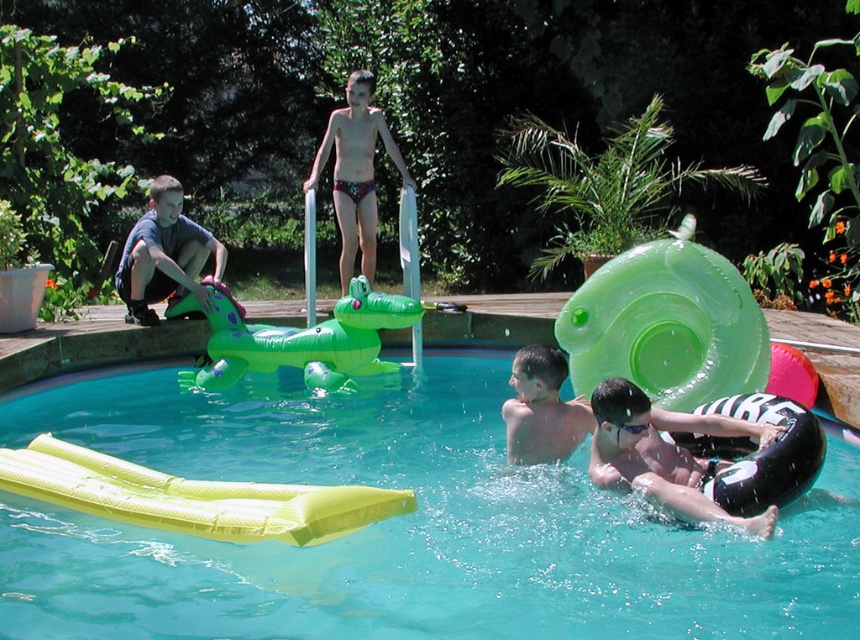
Can you confirm if black rubber ring at lower right is positioned below matte green crocodile at left?

Yes.

Is point (647, 440) farther from camera compared to point (164, 276)?

That is False.

The height and width of the screenshot is (640, 860). I want to click on black rubber ring at lower right, so click(x=664, y=454).

The image size is (860, 640). I want to click on green inflatable crocodile at center, so click(301, 340).

Does green inflatable crocodile at center appear on the right side of matte green crocodile at left?

Correct, you'll find green inflatable crocodile at center to the right of matte green crocodile at left.

What do you see at coordinates (301, 340) in the screenshot? The height and width of the screenshot is (640, 860). I see `green inflatable crocodile at center` at bounding box center [301, 340].

The image size is (860, 640). Identify the location of green inflatable crocodile at center. (301, 340).

Is green inflatable crocodile at center to the right of multicolored bikini at center from the viewer's perspective?

Incorrect, green inflatable crocodile at center is not on the right side of multicolored bikini at center.

Looking at this image, which is more to the right, green inflatable crocodile at center or multicolored bikini at center?

multicolored bikini at center

The width and height of the screenshot is (860, 640). Identify the location of green inflatable crocodile at center. (301, 340).